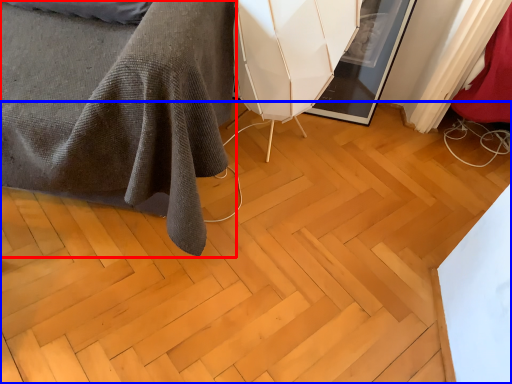
Question: Which of the following is the farthest to the observer, furniture (highlighted by a red box) or plywood (highlighted by a blue box)?

Choices:
 (A) furniture
 (B) plywood

Answer: (B)